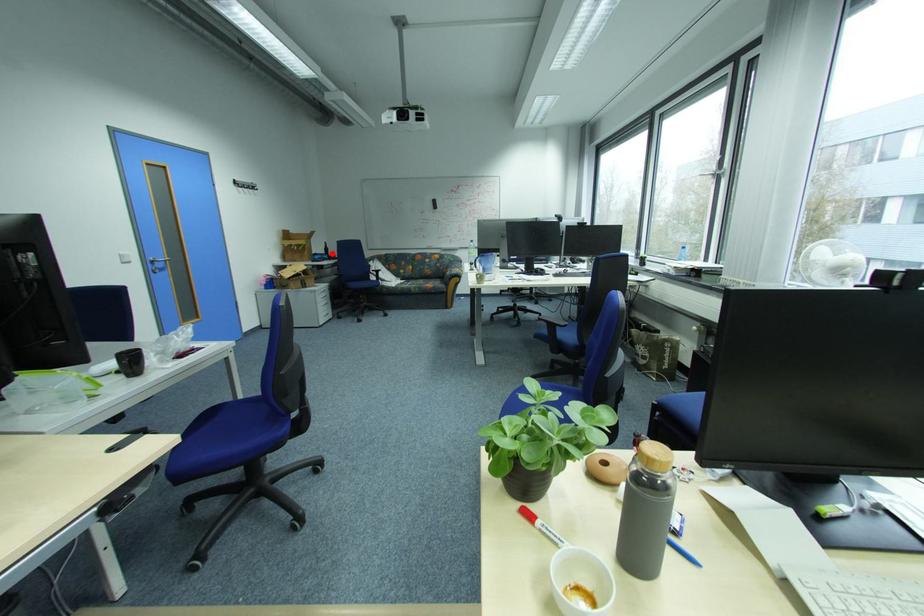
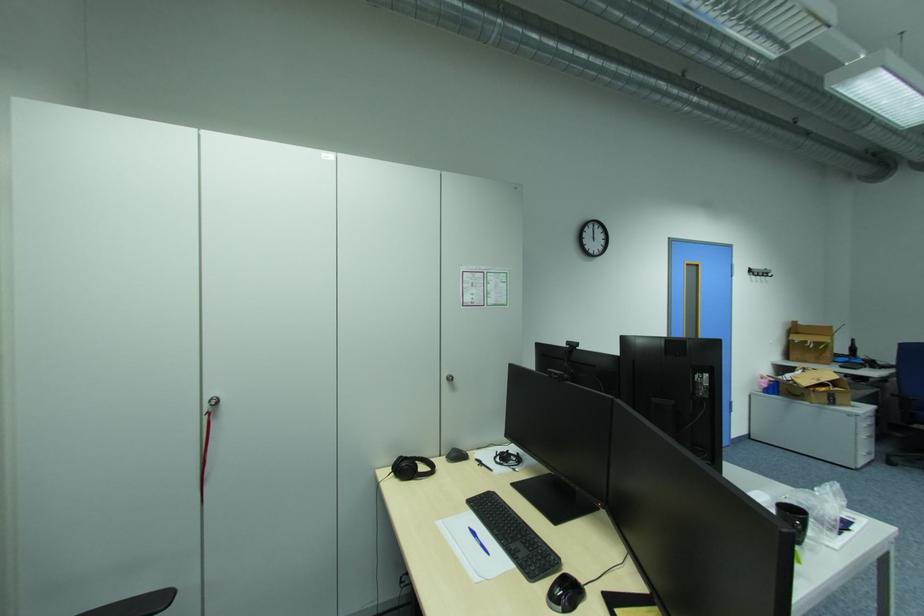
Locate, in the second image, the point that corresponds to the highlighted location in the first image.

(855, 354)